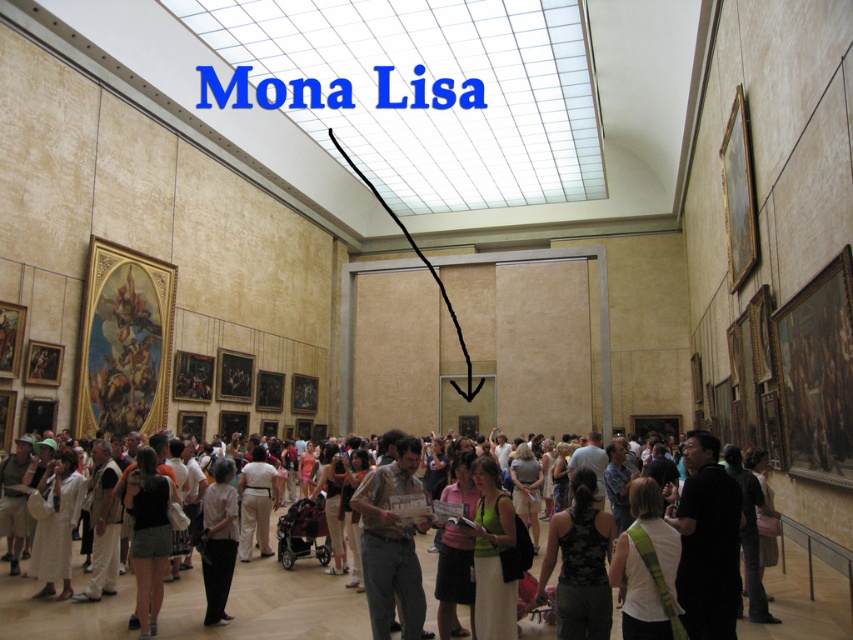
You are standing in the gallery and notice two pieces of clothing at the center. The green fabric dress at center and the black fabric skirt at center. Which one is nearer to you?

The green fabric dress at center is closer to the viewer than the black fabric skirt at center.

You are standing in the gallery and want to take a photo of both the camouflage tank top at center and the green fabric dress at center. Which one should you focus on first to ensure both are in clear view?

You should focus on the camouflage tank top at center first since it is closer to the viewer than the green fabric dress at center, allowing both to be in clear view when properly focused.